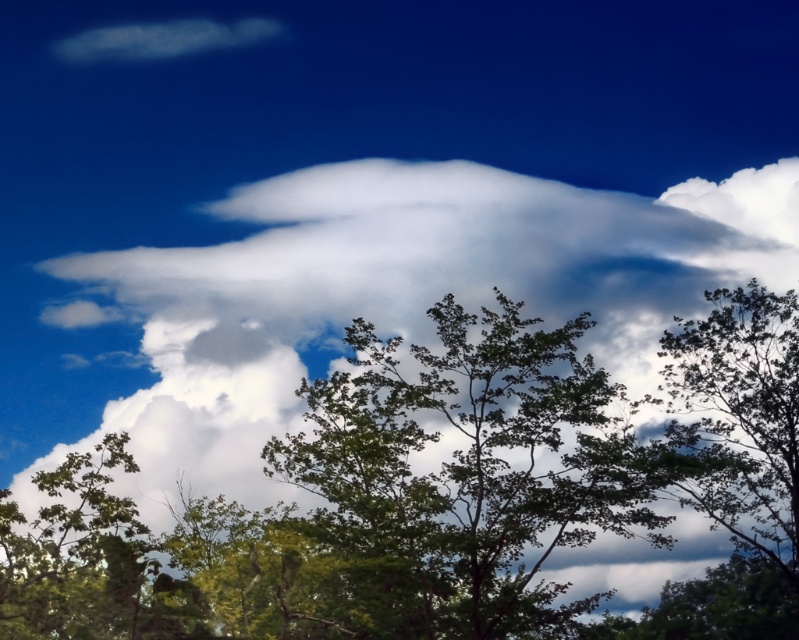
Question: Does green leafy tree at center have a larger size compared to green leafy tree at upper right?

Choices:
 (A) yes
 (B) no

Answer: (A)

Question: Which point is farther to the camera?

Choices:
 (A) [x=698, y=470]
 (B) [x=474, y=570]

Answer: (A)

Question: Can you confirm if white fluffy cloud at upper center is positioned below green leafy tree at center?

Choices:
 (A) yes
 (B) no

Answer: (B)

Question: Considering the real-world distances, which object is farthest from the white fluffy cloud at upper center?

Choices:
 (A) green leafy tree at center
 (B) green leafy tree at upper right

Answer: (A)

Question: Is white fluffy cloud at upper center further to camera compared to green leafy tree at upper right?

Choices:
 (A) yes
 (B) no

Answer: (A)

Question: Which object is positioned farthest from the green leafy tree at center?

Choices:
 (A) white fluffy cloud at upper center
 (B) green leafy tree at upper right

Answer: (A)